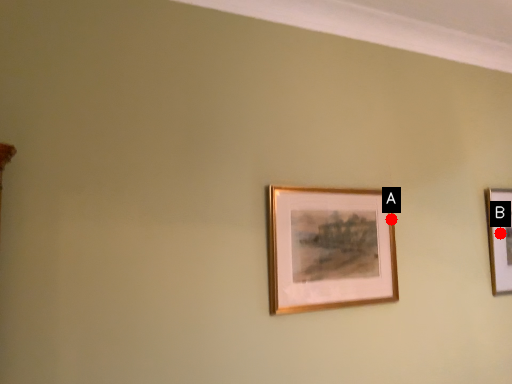
Question: Two points are circled on the image, labeled by A and B beside each circle. Which point appears closest to the camera in this image?

Choices:
 (A) A is closer
 (B) B is closer

Answer: (A)